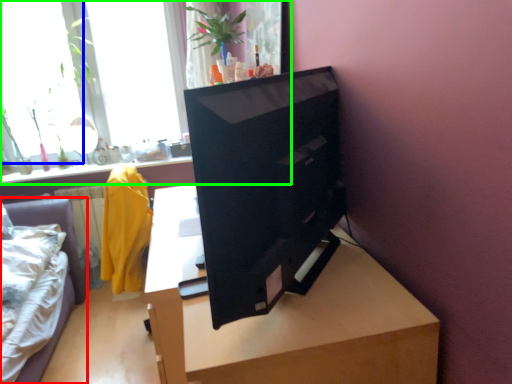
Question: Estimate the real-world distances between objects in this image. Which object is farther from furniture (highlighted by a red box), window (highlighted by a blue box) or window (highlighted by a green box)?

Choices:
 (A) window
 (B) window

Answer: (B)